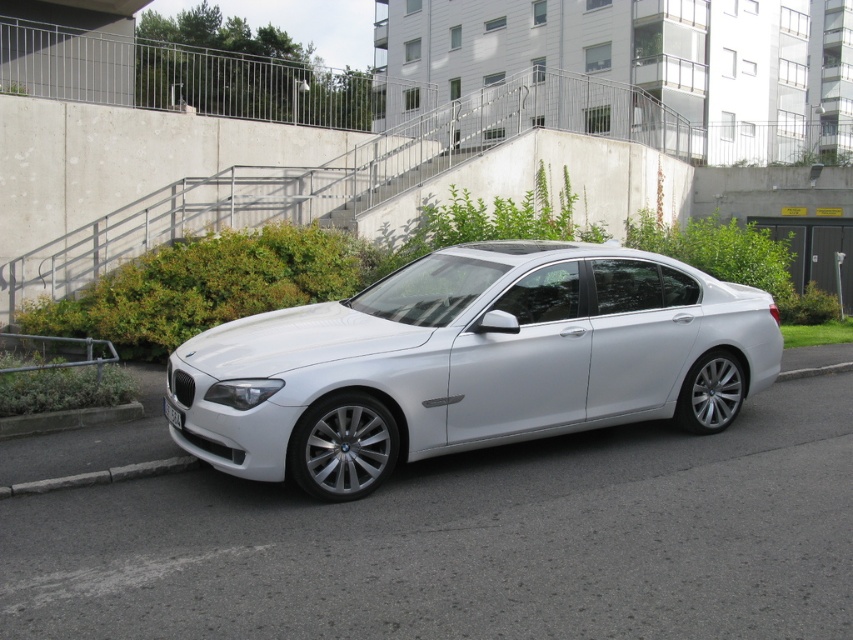
Question: Which is nearer to the white plastic license plate at lower center?

Choices:
 (A) gray concrete curb at lower left
 (B) white metallic car at center

Answer: (A)

Question: From the image, what is the correct spatial relationship of gray concrete curb at lower left in relation to white plastic license plate at lower center?

Choices:
 (A) left
 (B) right

Answer: (A)

Question: Which of the following is the farthest from the observer?

Choices:
 (A) (140, 468)
 (B) (173, 412)

Answer: (A)

Question: Among these objects, which one is nearest to the camera?

Choices:
 (A) white metallic car at center
 (B) white plastic license plate at lower center

Answer: (A)

Question: In this image, where is white metallic car at center located relative to white plastic license plate at lower center?

Choices:
 (A) above
 (B) below

Answer: (A)

Question: Is gray concrete curb at lower left smaller than white plastic license plate at lower center?

Choices:
 (A) yes
 (B) no

Answer: (B)